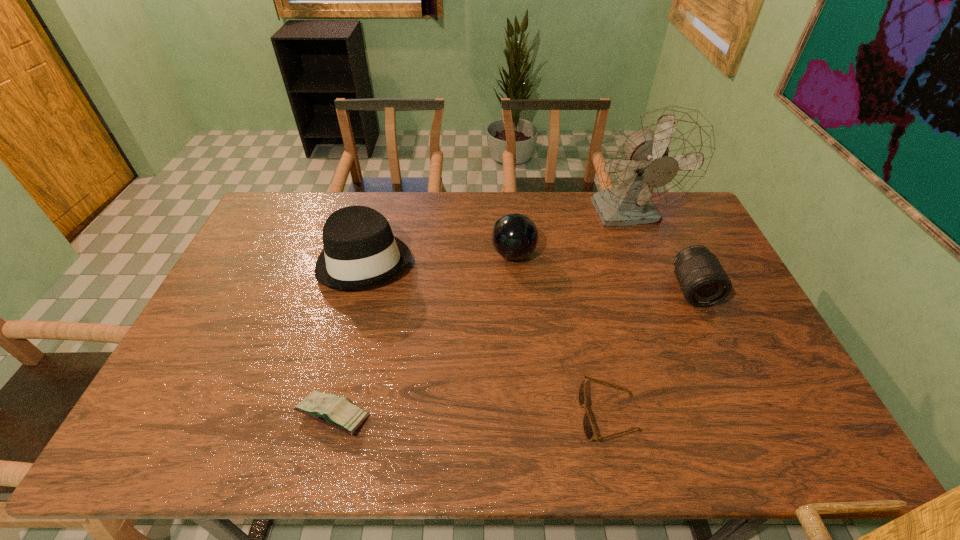
I want to click on vacant space that is in between the telephoto lens and the tallest object, so click(660, 252).

This screenshot has height=540, width=960. I want to click on vacant space that is in between the fan and the third tallest object, so click(x=571, y=234).

This screenshot has width=960, height=540. What are the coordinates of `free point between the third shortest object and the third tallest object` in the screenshot? It's located at (603, 272).

You are a GUI agent. You are given a task and a screenshot of the screen. Output one action in this format:
    pyautogui.click(x=<x>, y=<y>)
    Task: Click on the free space between the bowling ball and the telephoto lens
    This screenshot has height=540, width=960.
    Given the screenshot: What is the action you would take?
    pyautogui.click(x=603, y=272)

This screenshot has width=960, height=540. In order to click on free space between the diary and the sunglasses in this screenshot , I will do `click(470, 415)`.

Locate an element on the screen. This screenshot has height=540, width=960. free point between the fedora and the telephoto lens is located at coordinates point(529,275).

I want to click on free spot between the third shortest object and the diary, so click(x=513, y=352).

Choose which object is the fifth nearest neighbor to the telephoto lens. Please provide its 2D coordinates. Your answer should be formatted as a tuple, i.e. [(x, y)], where the tuple contains the x and y coordinates of a point satisfying the conditions above.

[(338, 412)]

This screenshot has height=540, width=960. What are the coordinates of `object that ranks as the fifth closest to the bowling ball` in the screenshot? It's located at (338, 412).